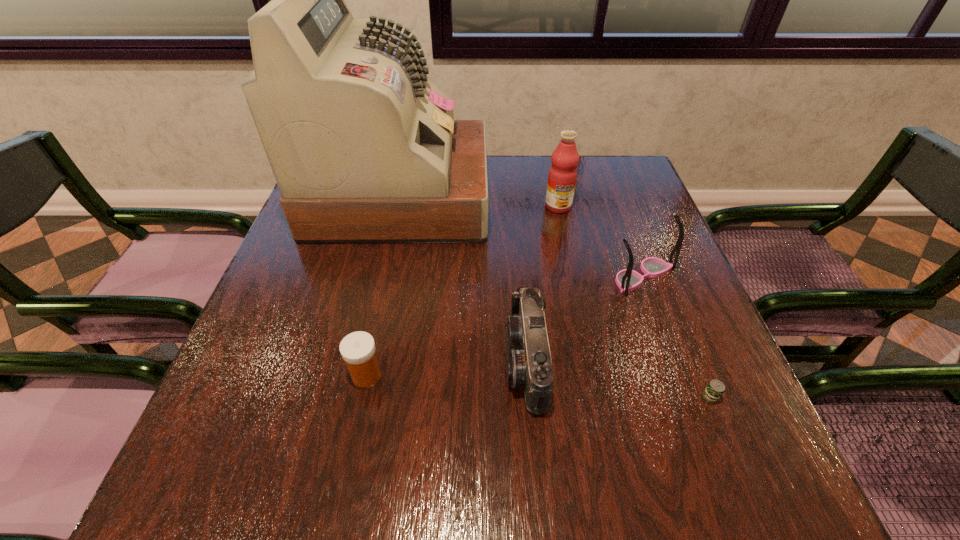
The height and width of the screenshot is (540, 960). Identify the location of vacant space that satisfies the following two spatial constraints: 1. on the label of the spectacles; 2. on the right side of the fruit juice. (573, 276).

The width and height of the screenshot is (960, 540). In order to click on vacant space that satisfies the following two spatial constraints: 1. on the label of the fourth object from left to right; 2. on the right side of the shortest object in this screenshot , I will do `click(598, 397)`.

What are the coordinates of `vacant space that satisfies the following two spatial constraints: 1. on the label of the fourth object from left to right; 2. on the front-facing side of the third object from left to right` in the screenshot? It's located at (590, 361).

Where is `free point that satisfies the following two spatial constraints: 1. on the label of the third object from right to left; 2. on the front-facing side of the camcorder`? The image size is (960, 540). free point that satisfies the following two spatial constraints: 1. on the label of the third object from right to left; 2. on the front-facing side of the camcorder is located at coordinates (590, 361).

Locate an element on the screen. The image size is (960, 540). free space that satisfies the following two spatial constraints: 1. on the front-facing side of the camcorder; 2. on the back side of the beer can is located at coordinates (530, 397).

You are a GUI agent. You are given a task and a screenshot of the screen. Output one action in this format:
    pyautogui.click(x=<x>, y=<y>)
    Task: Click on the free space that satisfies the following two spatial constraints: 1. on the operating side of the medicine; 2. on the right side of the cash register
    The height and width of the screenshot is (540, 960).
    Given the screenshot: What is the action you would take?
    pyautogui.click(x=361, y=375)

At what (x,y) coordinates should I click in order to perform the action: click on vacant region that satisfies the following two spatial constraints: 1. on the label of the third object from right to left; 2. on the front-facing side of the camcorder. Please return your answer as a coordinate pair (x, y). The width and height of the screenshot is (960, 540). Looking at the image, I should click on (590, 361).

At what (x,y) coordinates should I click in order to perform the action: click on vacant space that satisfies the following two spatial constraints: 1. on the label of the second tallest object; 2. on the front-facing side of the camcorder. Please return your answer as a coordinate pair (x, y). This screenshot has width=960, height=540. Looking at the image, I should click on (590, 361).